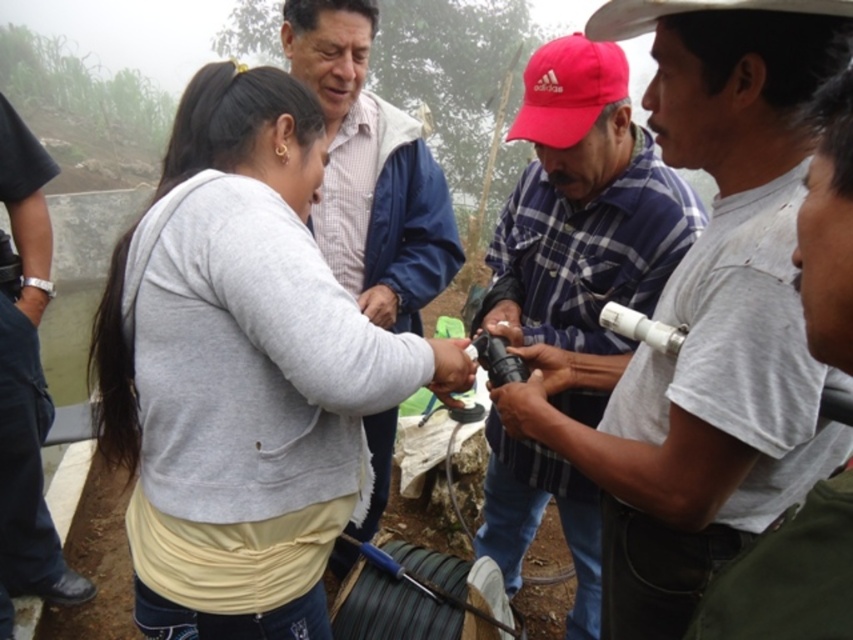
You are organizing a costume party and need to decide which costume to try on first. You see the light gray sweatshirt at center and the plaid fabric shirt at center. Which costume has a smaller size?

The light gray sweatshirt at center is smaller than the plaid fabric shirt at center, so the light gray sweatshirt at center has the smaller size.

You are a photographer trying to capture a clear shot of the light gray sweatshirt at center and the black leather watch at left. Since the camera can only focus on objects of a certain height, which object should you prioritize to ensure it is in focus?

The light gray sweatshirt at center has a lesser height compared to the black leather watch at left, so you should prioritize focusing on the black leather watch at left to ensure it is in focus.